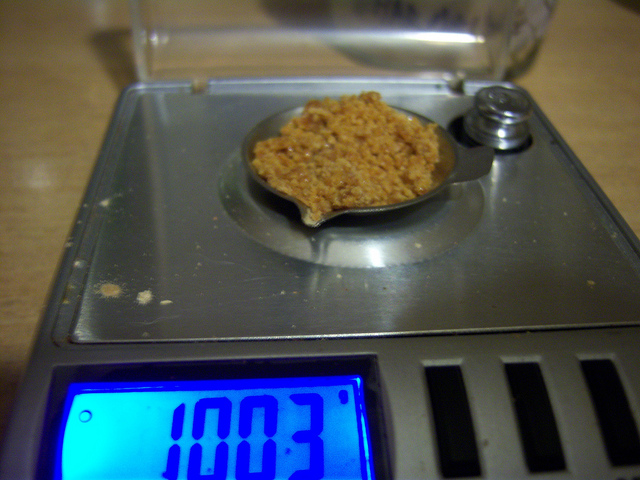
Where is `front of scale`? Image resolution: width=640 pixels, height=480 pixels. front of scale is located at coordinates (418, 456).